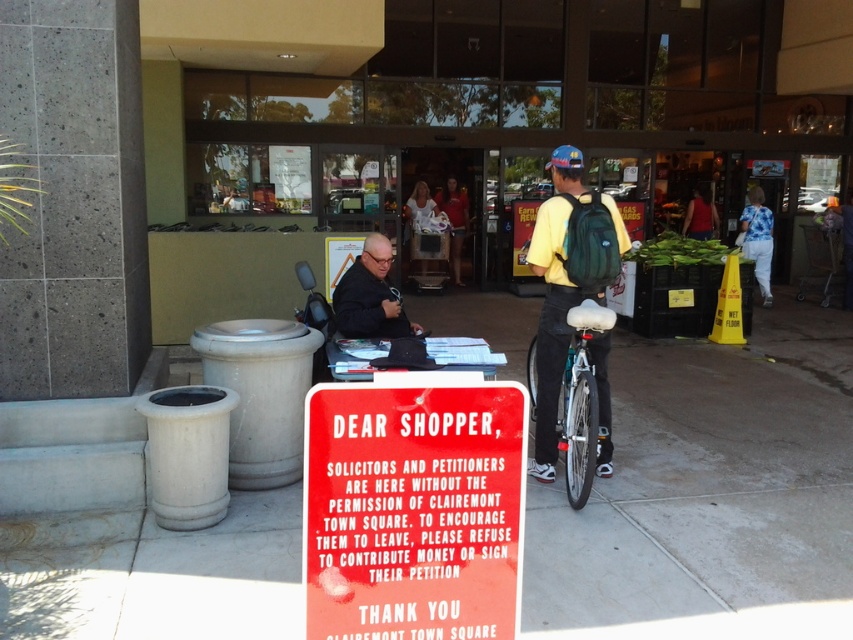
Does blue floral shirt at right come in front of matte red shirt at center?

Yes, it is in front of matte red shirt at center.

Which of these two, blue floral shirt at right or matte red shirt at center, stands shorter?

matte red shirt at center is shorter.

Between point (764, 296) and point (695, 236), which one is positioned behind?

The point (695, 236) is more distant.

I want to click on blue floral shirt at right, so click(757, 240).

Can you confirm if green fabric backpack at right is smaller than black matte shirt at center?

No, green fabric backpack at right is not smaller than black matte shirt at center.

Who is more distant from viewer, (x=590, y=289) or (x=358, y=314)?

Positioned behind is point (x=358, y=314).

Identify the location of green fabric backpack at right. (567, 282).

Can you confirm if green fabric backpack at right is positioned above blue floral shirt at right?

No.

Can you confirm if green fabric backpack at right is wider than blue floral shirt at right?

Correct, the width of green fabric backpack at right exceeds that of blue floral shirt at right.

Locate an element on the screen. green fabric backpack at right is located at coordinates (567, 282).

Locate an element on the screen. The height and width of the screenshot is (640, 853). green fabric backpack at right is located at coordinates (567, 282).